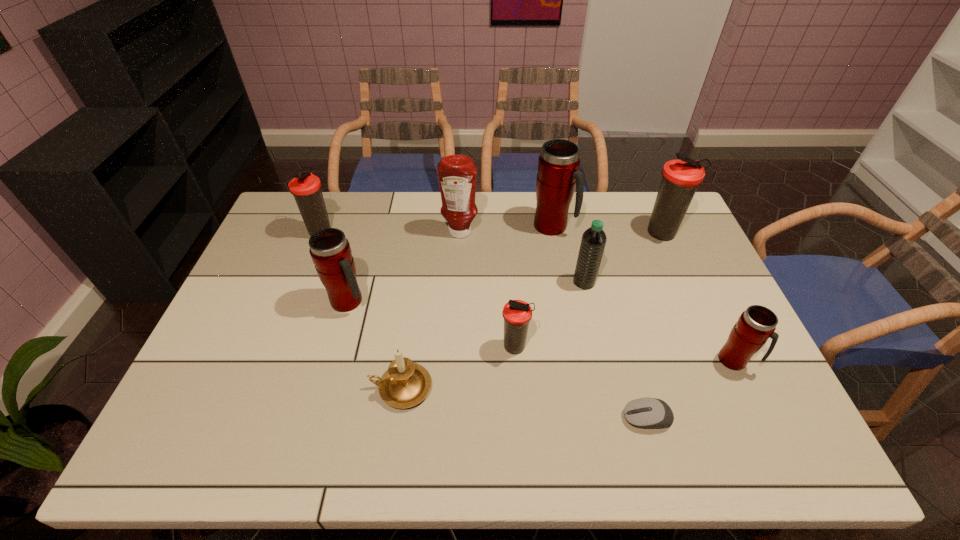
Identify the location of free space located 0.220m on the back of the water bottle. The height and width of the screenshot is (540, 960). (572, 229).

At what (x,y) coordinates should I click in order to perform the action: click on vacant position located 0.150m on the left of the third thermos bottle from left to right. Please return your answer as a coordinate pair (x, y). The image size is (960, 540). Looking at the image, I should click on (444, 348).

Where is `free region located 0.400m with a handle on the side of the beige candle holder`? The image size is (960, 540). free region located 0.400m with a handle on the side of the beige candle holder is located at coordinates (209, 388).

Locate an element on the screen. The height and width of the screenshot is (540, 960). vacant space situated with a handle on the side of the beige candle holder is located at coordinates (218, 388).

The height and width of the screenshot is (540, 960). In order to click on vacant space located with a handle on the side of the beige candle holder in this screenshot , I will do `click(298, 388)`.

The image size is (960, 540). In order to click on free space located 0.050m on the wheel side of the computer equipment in this screenshot , I will do `click(602, 418)`.

The width and height of the screenshot is (960, 540). In order to click on free space located 0.080m on the wheel side of the computer equipment in this screenshot , I will do `click(588, 418)`.

The image size is (960, 540). Identify the location of vacant space located on the wheel side of the computer equipment. (602, 418).

Identify the location of condiment that is at the far edge. (457, 174).

Find the location of a particular element. This screenshot has height=540, width=960. object that is at the near edge is located at coordinates point(647,413).